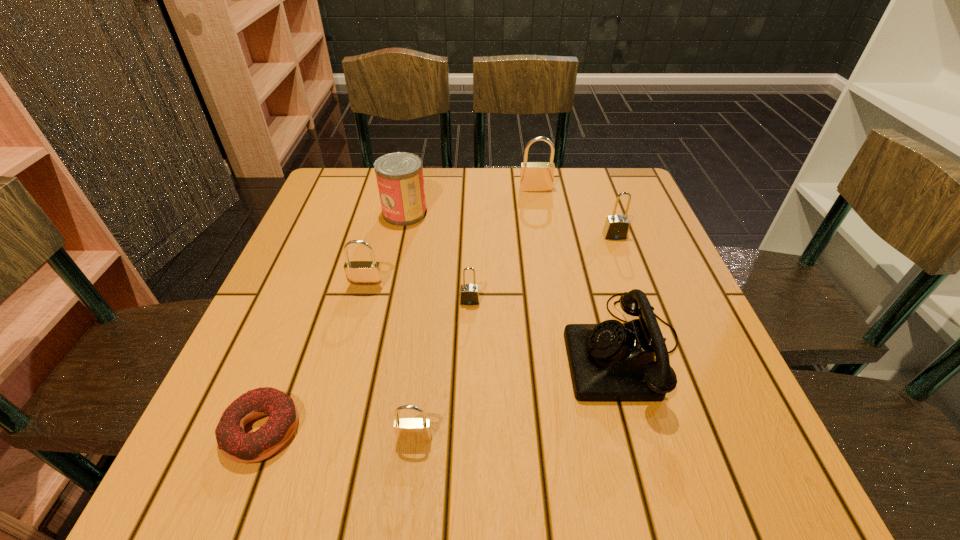
Where is `the fourth object from left to right`? The image size is (960, 540). the fourth object from left to right is located at coordinates (407, 430).

At what (x,y) coordinates should I click in order to perform the action: click on the smallest brass padlock. Please return your answer as a coordinate pair (x, y). Image resolution: width=960 pixels, height=540 pixels. Looking at the image, I should click on (407, 430).

You are a GUI agent. You are given a task and a screenshot of the screen. Output one action in this format:
    pyautogui.click(x=<x>, y=<y>)
    Task: Click on the leftmost object
    
    Given the screenshot: What is the action you would take?
    pyautogui.click(x=238, y=446)

I want to click on doughnut, so click(x=238, y=446).

The image size is (960, 540). Find the location of `free location located on the front-facing side of the biggest brass padlock`. free location located on the front-facing side of the biggest brass padlock is located at coordinates (542, 230).

Locate an element on the screen. The width and height of the screenshot is (960, 540). vacant point located 0.210m on the right of the second farthest object is located at coordinates (511, 213).

Where is `vacant space located 0.160m on the shackle of the fourth nearest padlock`? Image resolution: width=960 pixels, height=540 pixels. vacant space located 0.160m on the shackle of the fourth nearest padlock is located at coordinates (x=634, y=288).

Locate an element on the screen. The image size is (960, 540). vacant space located on the front-facing side of the leftmost padlock is located at coordinates tap(355, 327).

Find the location of a particular element. The image size is (960, 540). vacant region located 0.300m on the front face of the telephone is located at coordinates (399, 348).

Find the location of a particular element. This screenshot has width=960, height=540. free location located 0.080m on the front face of the telephone is located at coordinates (521, 348).